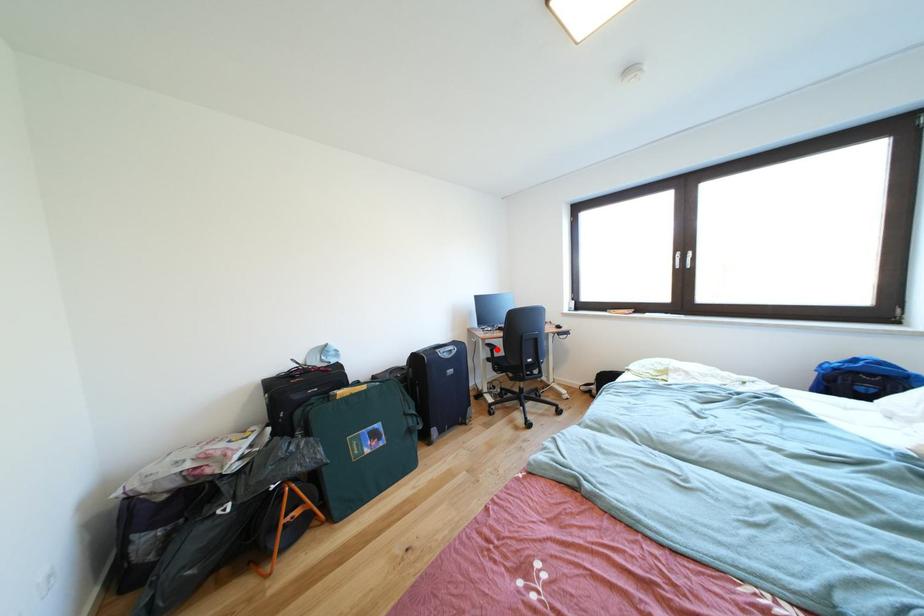
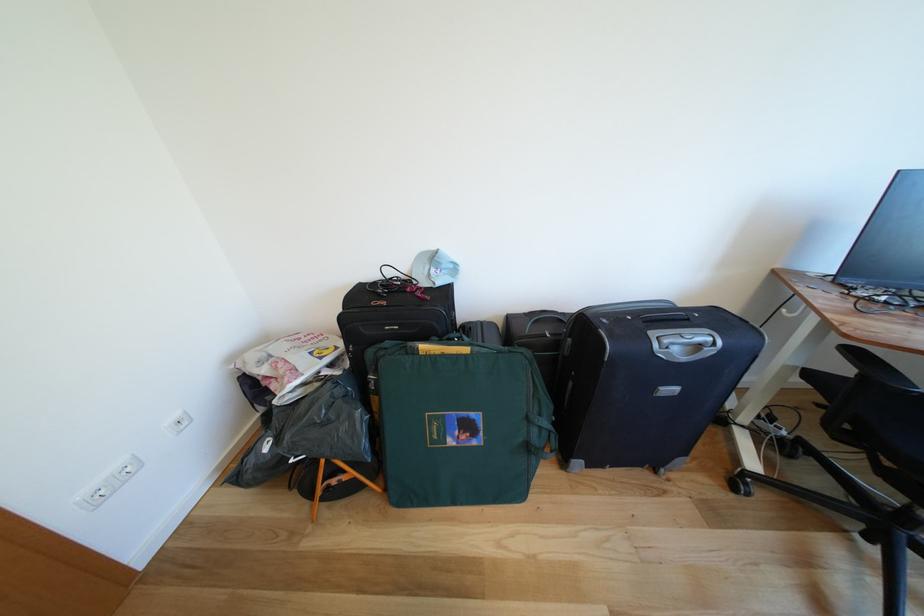
In the second image, find the point that corresponds to the highlighted location in the first image.

(862, 357)